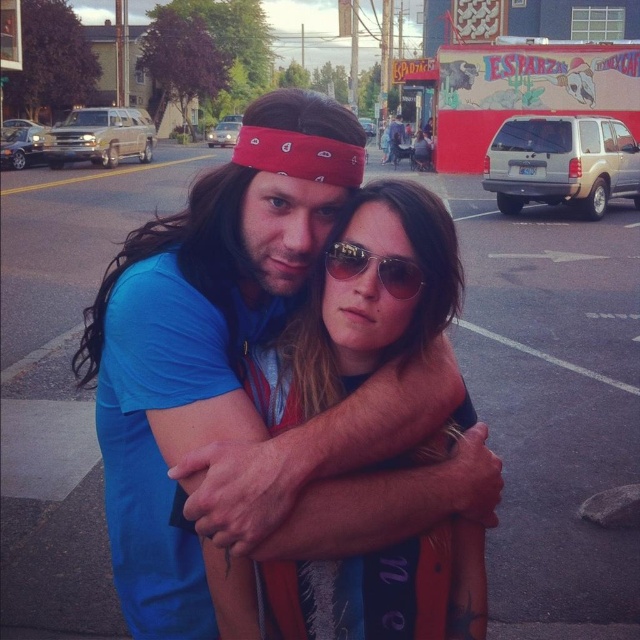
Can you confirm if matte blue shirt at center is wider than sunglasses at center?

Indeed, matte blue shirt at center has a greater width compared to sunglasses at center.

Between point (368, 198) and point (396, 269), which one is positioned behind?

The point (368, 198) is more distant.

Identify the location of matte blue shirt at center. (362, 305).